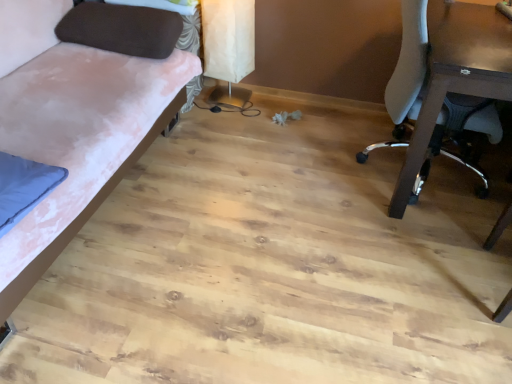
Question: Is white mesh chair at right outside of brown fabric pillow at upper left?

Choices:
 (A) yes
 (B) no

Answer: (A)

Question: Does white mesh chair at right have a lesser height compared to brown fabric pillow at upper left?

Choices:
 (A) yes
 (B) no

Answer: (B)

Question: Is the position of white mesh chair at right more distant than that of brown fabric pillow at upper left?

Choices:
 (A) yes
 (B) no

Answer: (B)

Question: Is white mesh chair at right in contact with brown fabric pillow at upper left?

Choices:
 (A) yes
 (B) no

Answer: (B)

Question: From a real-world perspective, is white mesh chair at right on brown fabric pillow at upper left?

Choices:
 (A) yes
 (B) no

Answer: (B)

Question: From a real-world perspective, is velvet pink fabric couch at left positioned above or below white mesh chair at right?

Choices:
 (A) below
 (B) above

Answer: (A)

Question: From the image's perspective, is velvet pink fabric couch at left positioned above or below white mesh chair at right?

Choices:
 (A) above
 (B) below

Answer: (B)

Question: Considering their positions, is velvet pink fabric couch at left located in front of or behind white mesh chair at right?

Choices:
 (A) front
 (B) behind

Answer: (A)

Question: Choose the correct answer: Is velvet pink fabric couch at left inside white mesh chair at right or outside it?

Choices:
 (A) outside
 (B) inside

Answer: (A)

Question: Considering their positions, is white mesh chair at right located in front of or behind white paper lampshade at upper center?

Choices:
 (A) behind
 (B) front

Answer: (B)

Question: From the image's perspective, is white mesh chair at right above or below white paper lampshade at upper center?

Choices:
 (A) below
 (B) above

Answer: (A)

Question: Does point (426, 99) appear closer or farther from the camera than point (214, 39)?

Choices:
 (A) closer
 (B) farther

Answer: (A)

Question: Considering the positions of white mesh chair at right and white paper lampshade at upper center in the image, is white mesh chair at right bigger or smaller than white paper lampshade at upper center?

Choices:
 (A) big
 (B) small

Answer: (A)

Question: Based on their sizes in the image, would you say velvet pink fabric couch at left is bigger or smaller than brown fabric pillow at upper left?

Choices:
 (A) big
 (B) small

Answer: (A)

Question: Is velvet pink fabric couch at left wider or thinner than brown fabric pillow at upper left?

Choices:
 (A) wide
 (B) thin

Answer: (A)